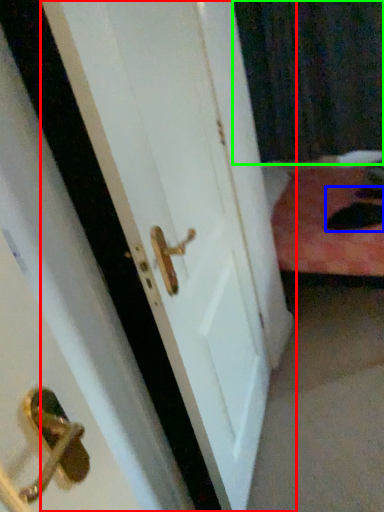
Question: Which object is the closest to the door (highlighted by a red box)? Choose among these: cat (highlighted by a blue box) or curtain (highlighted by a green box).

Choices:
 (A) cat
 (B) curtain

Answer: (A)